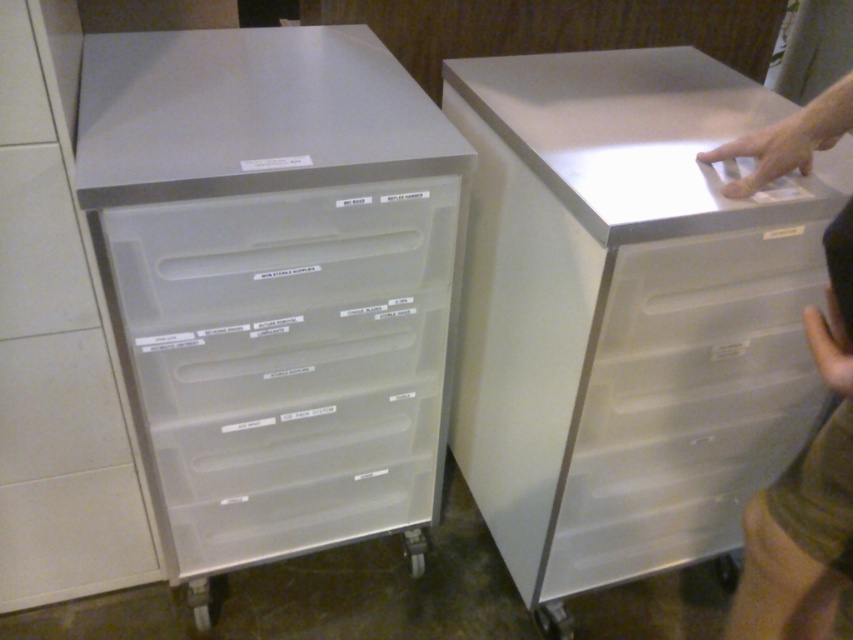
Question: Which of the following is the closest to the observer?

Choices:
 (A) satin silver drawer at upper center
 (B) clear plastic drawers at left

Answer: (B)

Question: Which object appears closest to the camera in this image?

Choices:
 (A) satin silver drawer at upper center
 (B) skinny jeans at right

Answer: (B)

Question: In this image, where is satin silver drawer at upper center located relative to skinny jeans at right?

Choices:
 (A) above
 (B) below

Answer: (A)

Question: Which point is closer to the camera?

Choices:
 (A) (808, 346)
 (B) (115, 157)

Answer: (B)

Question: Is clear plastic drawers at left to the right of skinny jeans at right from the viewer's perspective?

Choices:
 (A) yes
 (B) no

Answer: (B)

Question: Can you confirm if satin silver drawer at upper center is wider than skinny jeans at right?

Choices:
 (A) no
 (B) yes

Answer: (B)